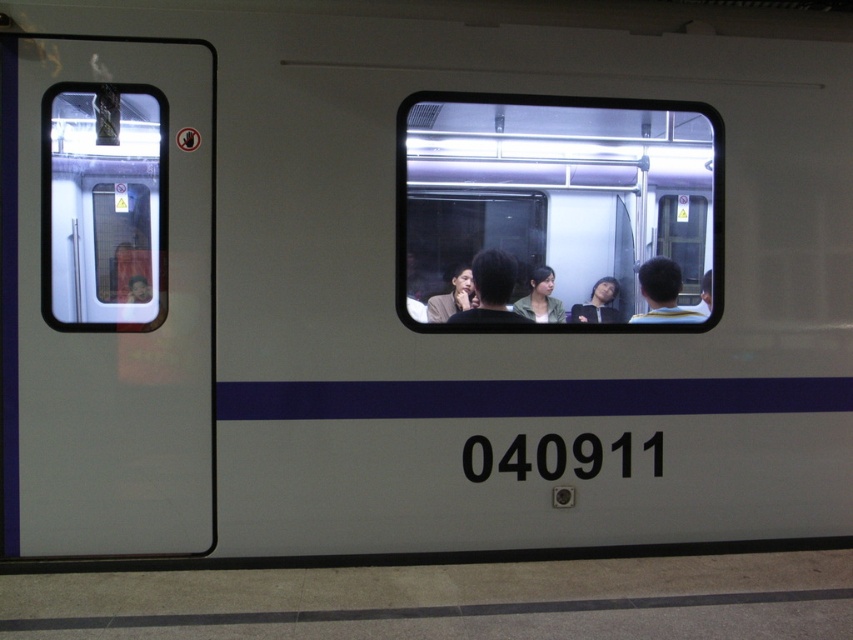
Question: Is the position of transparent glass train window at center less distant than that of transparent glass train window at left?

Choices:
 (A) yes
 (B) no

Answer: (B)

Question: Can you confirm if transparent glass train window at left is wider than matte black shirt at center?

Choices:
 (A) yes
 (B) no

Answer: (A)

Question: Estimate the real-world distances between objects in this image. Which object is farther from the transparent glass train window at center?

Choices:
 (A) matte black shirt at center
 (B) yellow striped shirt at center
 (C) transparent glass train window at left

Answer: (C)

Question: Is transparent glass train window at left positioned at the back of matte black shirt at center?

Choices:
 (A) no
 (B) yes

Answer: (A)

Question: Which object is the closest to the transparent glass train window at left?

Choices:
 (A) matte black shirt at center
 (B) matte black jacket at center

Answer: (A)

Question: Which object is positioned closest to the matte black shirt at center?

Choices:
 (A) yellow striped shirt at center
 (B) transparent glass train window at center
 (C) matte black jacket at center
 (D) transparent glass train window at left

Answer: (B)